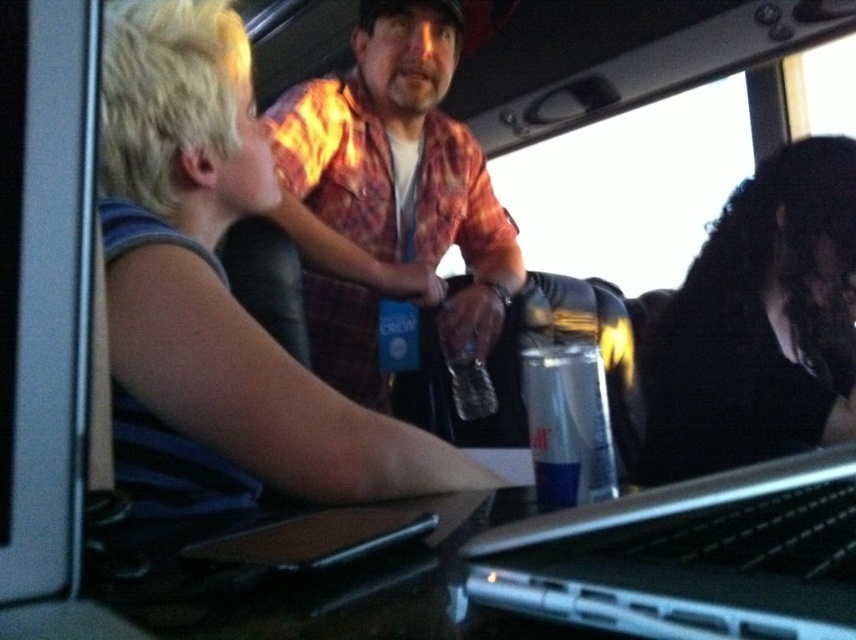
You are a passenger in the vehicle and need to reach the silver metallic laptop at center to grab your phone charger from under it. Can you easily access the area beneath the laptop without moving the flannel shirt at center?

The flannel shirt at center is further to the viewer than the silver metallic laptop at center, meaning the shirt is closer to you. Since the shirt is in front of the laptop, you cannot easily access the area beneath the laptop without moving the flannel shirt at center.

You are a passenger on a bus and you want to check your phone. You see the blonde hair at upper left and the silver metallic laptop at center. Which object is closer to you?

The blonde hair at upper left is taller than the silver metallic laptop at center, so the silver metallic laptop at center is closer to you.

You are inside a vehicle and need to reach a point behind both point (455, 468) and point (577, 394). Which point should you move towards?

You should move towards point (577, 394) because point (455, 468) is behind it, so moving towards the closer point will allow you to reach the desired location.